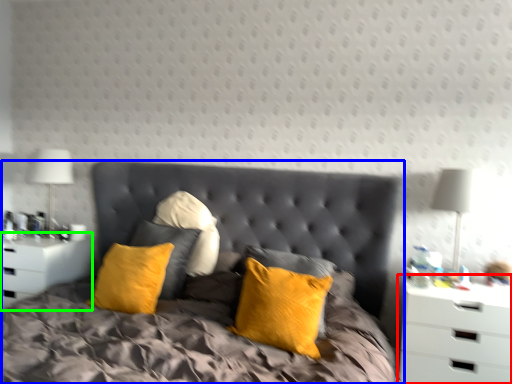
Question: Estimate the real-world distances between objects in this image. Which object is closer to nightstand (highlighted by a red box), bed (highlighted by a blue box) or nightstand (highlighted by a green box)?

Choices:
 (A) bed
 (B) nightstand

Answer: (A)